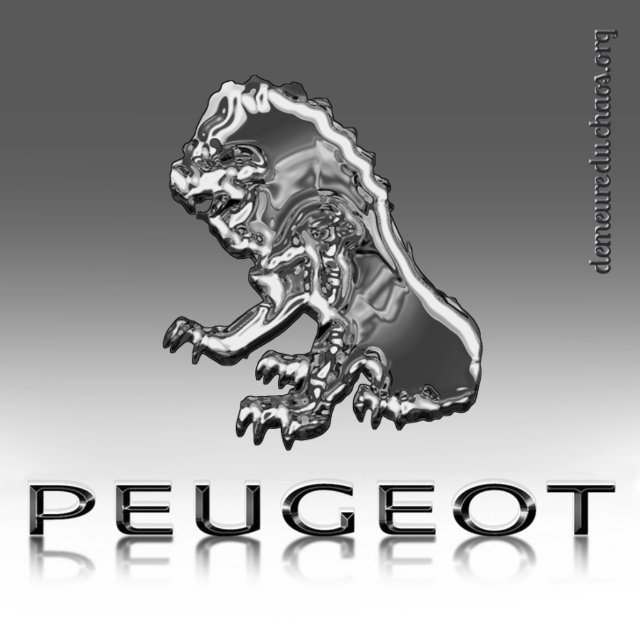
Based on the scene description, where is the shiny metallic lion at center located in terms of its 2D coordinates?

The shiny metallic lion at center is located at the 2D coordinates of point (317, 269).

You are designing a new car emblem and want to ensure the shiny metallic lion at center and the chrome metallic logo at center fit within a circular frame. Which object should you adjust in size to make them fit better?

The shiny metallic lion at center is thinner than the chrome metallic logo at center, so you should adjust the size of the chrome metallic logo at center to make it thinner to fit within the circular frame.

You are an engineer inspecting the emblem for defects. You notice a point at coordinates (317,269). What object is located at that point?

The point at coordinates (317,269) marks the shiny metallic lion at center.